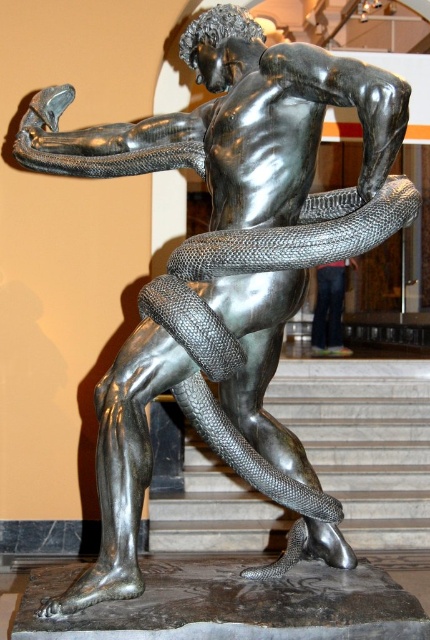
What are the coordinates of the shiny metallic snake at center in the image?

The shiny metallic snake at center is located at coordinates point (267, 262).

You are an art conservator examining the sculpture. You notice a point at coordinates (267, 262). What object is located at this point?

The point at coordinates (267, 262) corresponds to the shiny metallic snake at center.